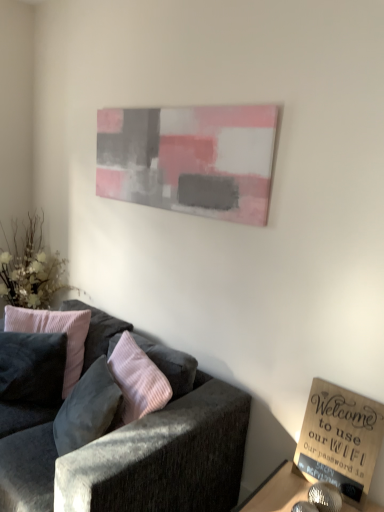
Question: Does velvet dark gray couch at lower left have a lesser height compared to wooden sign at lower right?

Choices:
 (A) yes
 (B) no

Answer: (B)

Question: Is the depth of velvet dark gray couch at lower left less than that of wooden sign at lower right?

Choices:
 (A) no
 (B) yes

Answer: (B)

Question: Does velvet dark gray couch at lower left come behind wooden sign at lower right?

Choices:
 (A) yes
 (B) no

Answer: (B)

Question: Is velvet dark gray couch at lower left smaller than wooden sign at lower right?

Choices:
 (A) yes
 (B) no

Answer: (B)

Question: Is velvet dark gray couch at lower left next to wooden sign at lower right?

Choices:
 (A) yes
 (B) no

Answer: (B)

Question: Considering the positions of velvet pink pillow at left, which appears as the 2th pillow when viewed from the left, and wooden sign at lower right in the image, is velvet pink pillow at left, which appears as the 2th pillow when viewed from the left, wider or thinner than wooden sign at lower right?

Choices:
 (A) wide
 (B) thin

Answer: (A)

Question: Is velvet pink pillow at left, which appears as the 2th pillow when viewed from the left, bigger or smaller than wooden sign at lower right?

Choices:
 (A) big
 (B) small

Answer: (A)

Question: Is velvet pink pillow at left, which appears as the 2th pillow when viewed from the left, taller or shorter than wooden sign at lower right?

Choices:
 (A) tall
 (B) short

Answer: (A)

Question: Would you say velvet pink pillow at left, placed as the 1th pillow when sorted from right to left, is to the left or to the right of wooden sign at lower right in the picture?

Choices:
 (A) right
 (B) left

Answer: (B)

Question: Is white fabric floral arrangement at left wider or thinner than wooden sign at lower right?

Choices:
 (A) wide
 (B) thin

Answer: (B)

Question: Based on their positions, is white fabric floral arrangement at left located to the left or right of wooden sign at lower right?

Choices:
 (A) left
 (B) right

Answer: (A)

Question: Choose the correct answer: Is white fabric floral arrangement at left inside wooden sign at lower right or outside it?

Choices:
 (A) inside
 (B) outside

Answer: (B)

Question: From the image's perspective, is white fabric floral arrangement at left positioned above or below wooden sign at lower right?

Choices:
 (A) above
 (B) below

Answer: (A)

Question: Considering their positions, is wooden sign at lower right located in front of or behind velvet pink pillow at left, which appears as the 2th pillow when viewed from the left?

Choices:
 (A) front
 (B) behind

Answer: (A)

Question: Considering the positions of wooden sign at lower right and velvet pink pillow at left, placed as the 1th pillow when sorted from right to left, in the image, is wooden sign at lower right taller or shorter than velvet pink pillow at left, placed as the 1th pillow when sorted from right to left,?

Choices:
 (A) short
 (B) tall

Answer: (A)